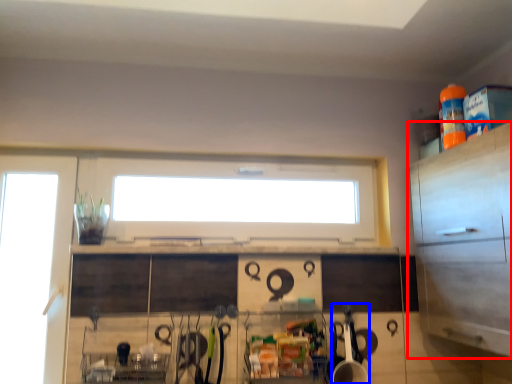
Question: Which point is further to the camera, cabinetry (highlighted by a red box) or appliance (highlighted by a blue box)?

Choices:
 (A) cabinetry
 (B) appliance

Answer: (B)